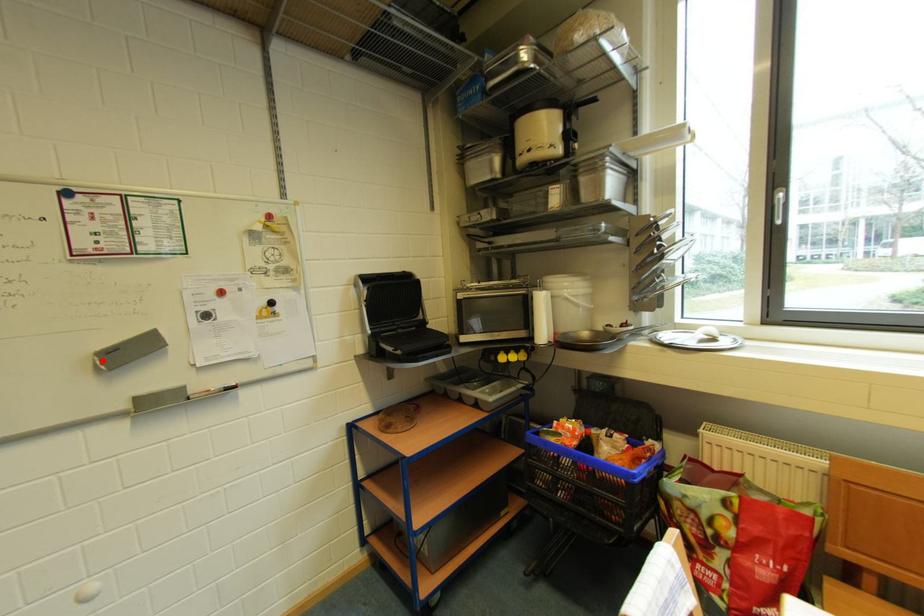
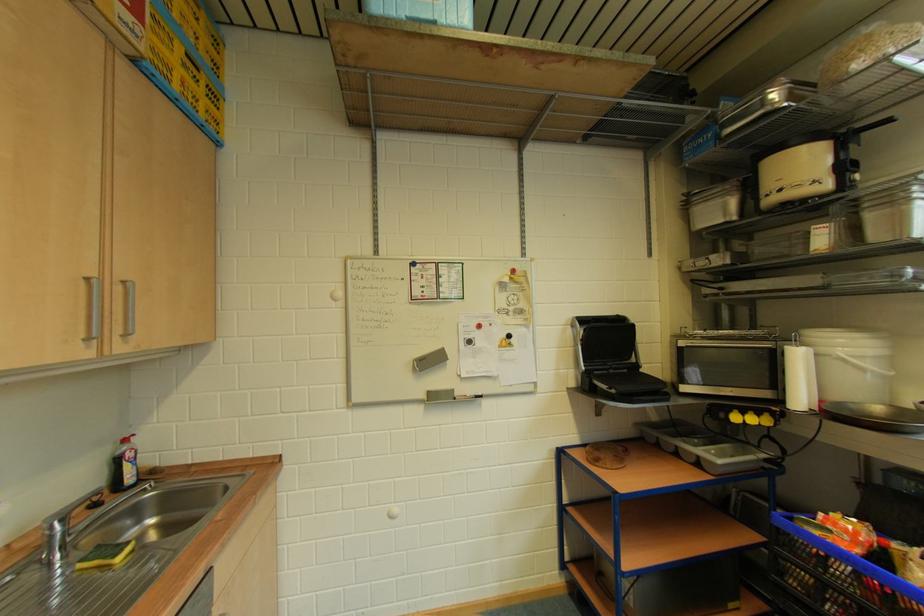
Locate, in the second image, the point that corresponds to the highlighted location in the first image.

(421, 365)